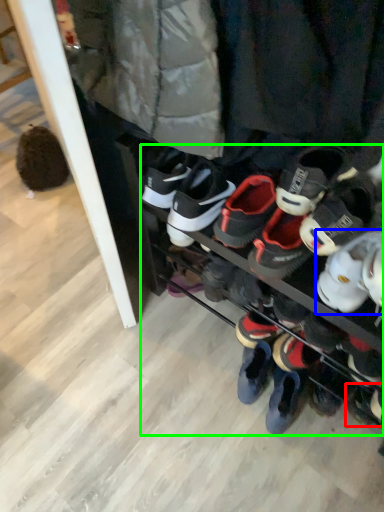
Question: Considering the real-world distances, which object is closest to footwear (highlighted by a red box)? footwear (highlighted by a blue box) or footwear (highlighted by a green box).

Choices:
 (A) footwear
 (B) footwear

Answer: (B)